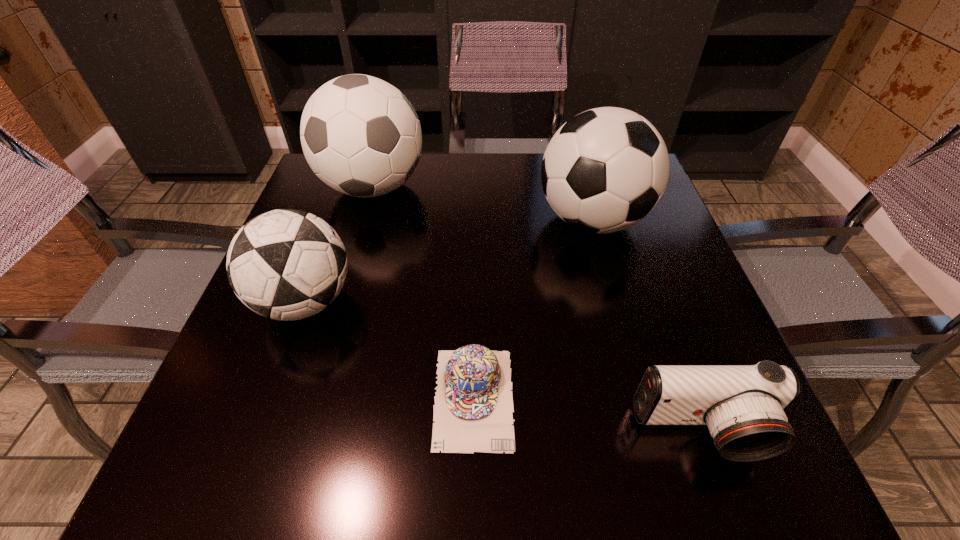
Where is `soccer ball that is at the right edge`? Image resolution: width=960 pixels, height=540 pixels. soccer ball that is at the right edge is located at coordinates (604, 170).

Locate an element on the screen. camcorder located in the right edge section of the desktop is located at coordinates (743, 406).

You are a GUI agent. You are given a task and a screenshot of the screen. Output one action in this format:
    pyautogui.click(x=<x>, y=<y>)
    Task: Click on the object present at the far left corner
    The height and width of the screenshot is (540, 960).
    Given the screenshot: What is the action you would take?
    pyautogui.click(x=360, y=135)

At what (x,y) coordinates should I click in order to perform the action: click on object that is at the far right corner. Please return your answer as a coordinate pair (x, y). The height and width of the screenshot is (540, 960). Looking at the image, I should click on (604, 170).

Locate an element on the screen. Image resolution: width=960 pixels, height=540 pixels. object positioned at the near right corner is located at coordinates (743, 406).

Locate an element on the screen. vacant space at the far edge of the desktop is located at coordinates pos(444,177).

I want to click on free spot at the near edge of the desktop, so click(440, 480).

This screenshot has width=960, height=540. Identify the location of vacant space at the left edge of the desktop. (272, 321).

Identify the location of vacant area at the right edge. (699, 309).

You are a GUI agent. You are given a task and a screenshot of the screen. Output one action in this format:
    pyautogui.click(x=<x>, y=<y>)
    Task: Click on the vacant position at the far left corner of the desktop
    This screenshot has height=540, width=960.
    Given the screenshot: What is the action you would take?
    pyautogui.click(x=327, y=191)